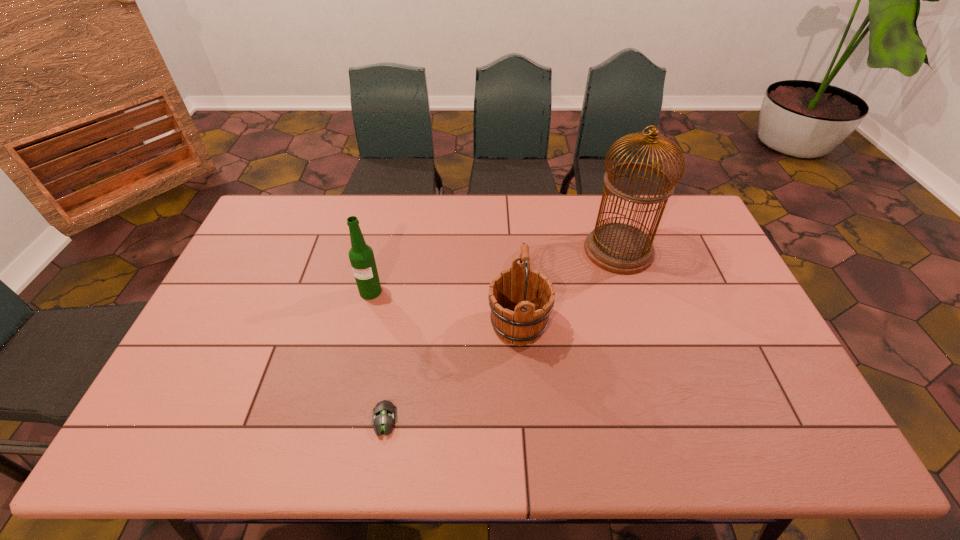
The width and height of the screenshot is (960, 540). I want to click on empty location between the nearest object and the leftmost object, so click(377, 356).

Image resolution: width=960 pixels, height=540 pixels. What are the coordinates of `vacant space that is in between the nearest object and the beer bottle` in the screenshot? It's located at (377, 356).

Identify the location of free space between the nearest object and the second object from right to left. This screenshot has height=540, width=960. (451, 373).

Image resolution: width=960 pixels, height=540 pixels. Identify the location of blank region between the wine bucket and the leftmost object. (444, 308).

You are a GUI agent. You are given a task and a screenshot of the screen. Output one action in this format:
    pyautogui.click(x=<x>, y=<y>)
    Task: Click on the free space between the leftmost object and the rightmost object
    This screenshot has height=540, width=960.
    Given the screenshot: What is the action you would take?
    point(494,271)

Locate an element on the screen. The height and width of the screenshot is (540, 960). vacant area that lies between the nearest object and the beer bottle is located at coordinates (377, 356).

The image size is (960, 540). I want to click on empty space between the farthest object and the wine bucket, so click(568, 288).

This screenshot has height=540, width=960. I want to click on free space between the leftmost object and the birdcage, so click(494, 271).

Locate an element on the screen. object that is the second closest to the third object from left to right is located at coordinates (384, 416).

You are a GUI agent. You are given a task and a screenshot of the screen. Output one action in this format:
    pyautogui.click(x=<x>, y=<y>)
    Task: Click on the object that is the nearest to the wine bucket
    Image resolution: width=960 pixels, height=540 pixels.
    Given the screenshot: What is the action you would take?
    pyautogui.click(x=619, y=248)